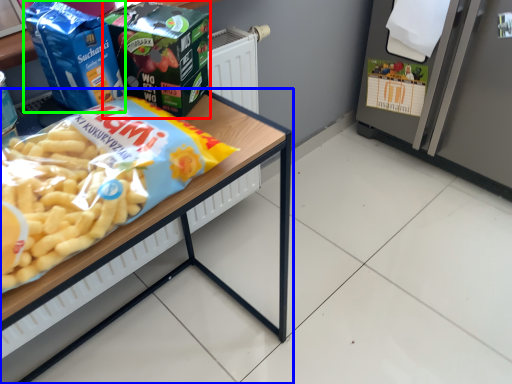
Question: Which is farther away from product (highlighted by a red box)? table (highlighted by a blue box) or product (highlighted by a green box)?

Choices:
 (A) table
 (B) product

Answer: (A)